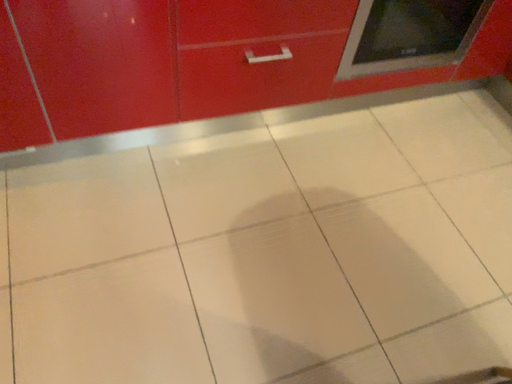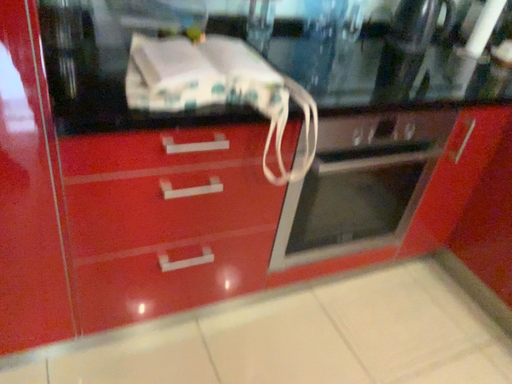
Question: Which way did the camera rotate in the video?

Choices:
 (A) rotated downward
 (B) rotated upward

Answer: (B)